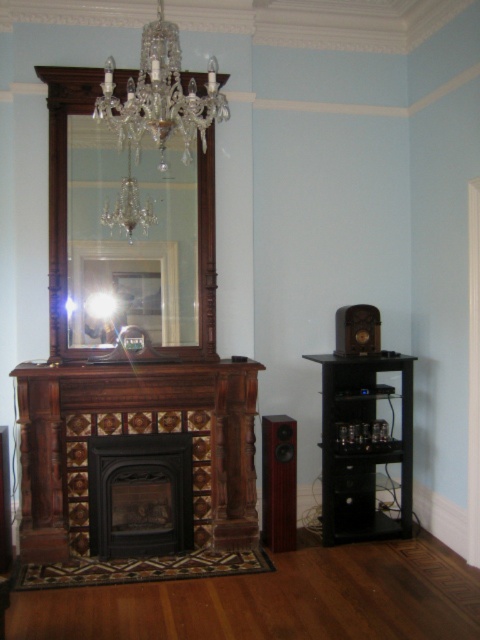
Question: Can you confirm if mahogany wood speaker at right is positioned to the left of clear crystal chandelier at upper center?

Choices:
 (A) no
 (B) yes

Answer: (A)

Question: Which object is positioned closest to the black matte fireplace at center?

Choices:
 (A) crystal glass chandelier at upper center
 (B) brown wood/marble fireplace at center

Answer: (B)

Question: Which of the following is the closest to the observer?

Choices:
 (A) mahogany wood speaker at right
 (B) crystal glass chandelier at upper center
 (C) black matte fireplace at center
 (D) brown wood/marble fireplace at center

Answer: (B)

Question: Where is crystal glass mirror at upper center located in relation to clear crystal chandelier at upper center in the image?

Choices:
 (A) above
 (B) below

Answer: (B)

Question: Considering the real-world distances, which object is farthest from the crystal glass mirror at upper center?

Choices:
 (A) mahogany wood speaker at right
 (B) brown wood/marble fireplace at center
 (C) black matte fireplace at center

Answer: (A)

Question: In this image, where is black matte fireplace at center located relative to crystal glass chandelier at upper center?

Choices:
 (A) right
 (B) left

Answer: (B)